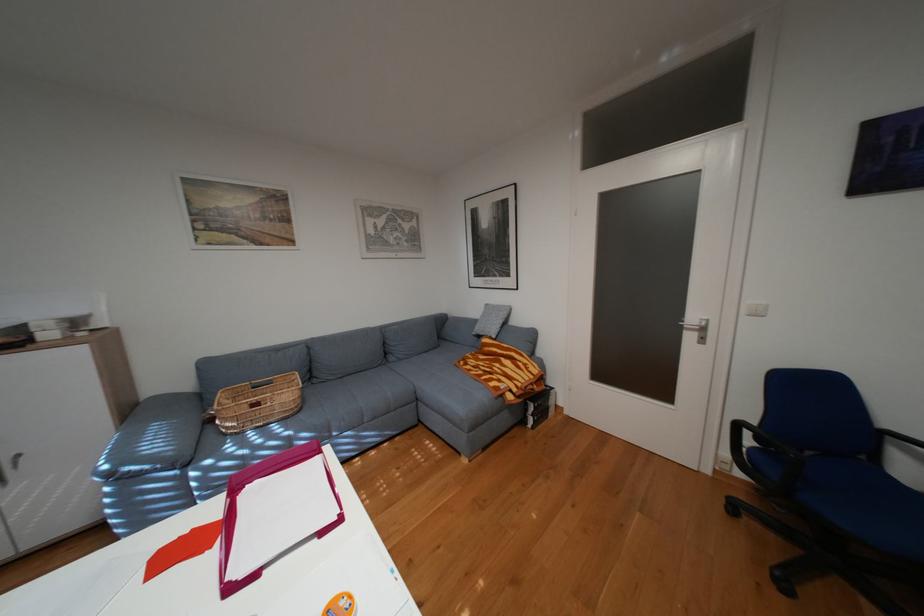
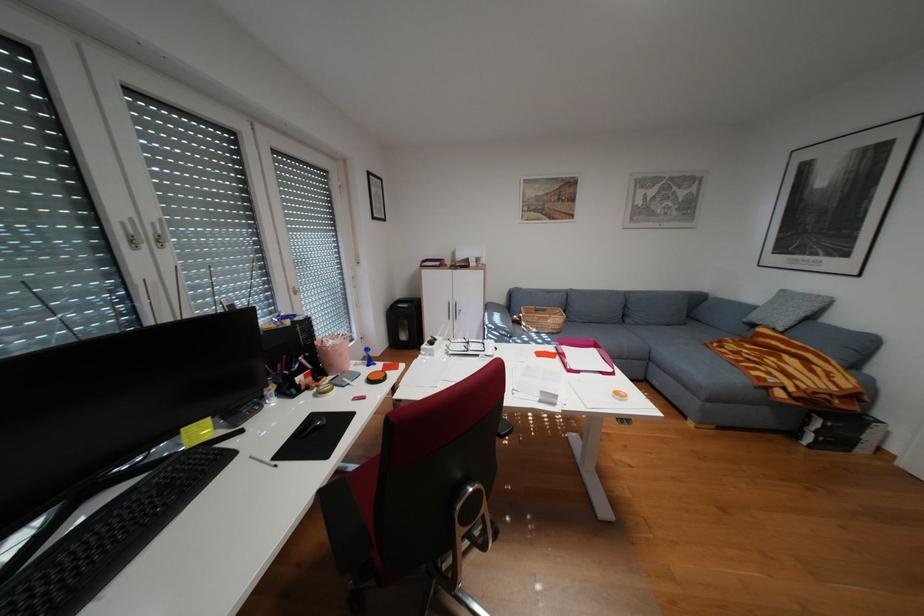
Locate, in the second image, the point that corresponds to point (268, 575) in the first image.

(590, 371)